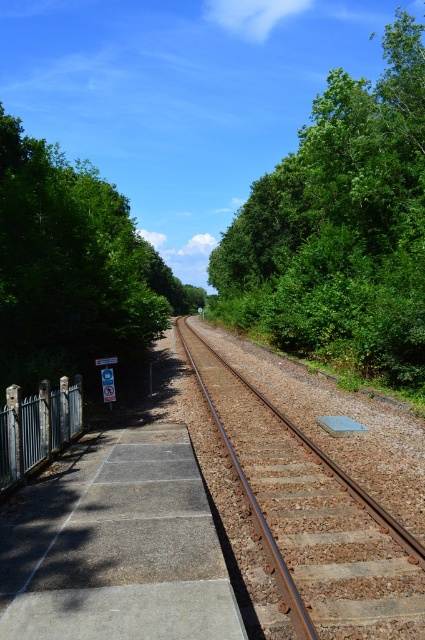
You are standing at the point with coordinates point (70, 266) in the image. What object is located at that point?

The point (70, 266) corresponds to a green leafy tree at left.

Based on the photo, you are standing at the point marked by coordinates (342,225) in the image. Looking around, you see a green leafy tree at upper right. Which direction should you face to look towards the green leafy tree at upper right?

The point at coordinates (342,225) is the location of the green leafy tree at upper right, so you are already facing it.

You are a painter standing on the paved walkway next to the green leafy tree at left and the rusty metal train track at center. You want to paint both objects in your canvas. Which object should you focus on first if you want to capture their full width in your painting?

The green leafy tree at left might be wider than the rusty metal train track at center, so you should focus on painting the green leafy tree at left first to ensure its full width is captured properly.